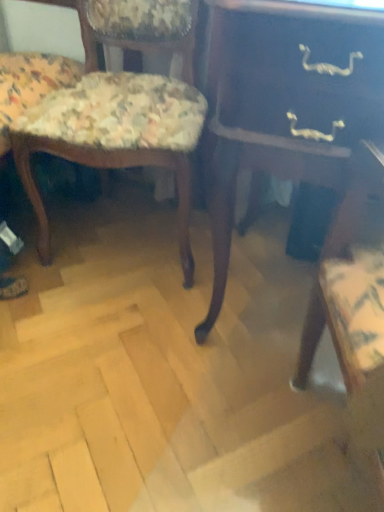
This screenshot has height=512, width=384. I want to click on space that is in front of floral fabric chair at left, the 2th chair positioned from the left, so click(108, 336).